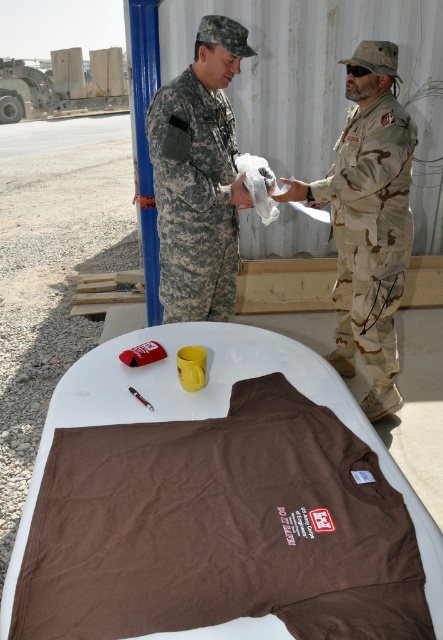
Between point (387, 272) and point (202, 84), which one is positioned in front?

Point (202, 84) is more forward.

Who is positioned more to the right, camouflage fabric uniform at right or camouflage fabric uniform at center?

Positioned to the right is camouflage fabric uniform at right.

Looking at this image, measure the distance between camouflage fabric uniform at right and camera.

camouflage fabric uniform at right and camera are 2.09 meters apart.

Where is `camouflage fabric uniform at right`? This screenshot has width=443, height=640. camouflage fabric uniform at right is located at coordinates (369, 234).